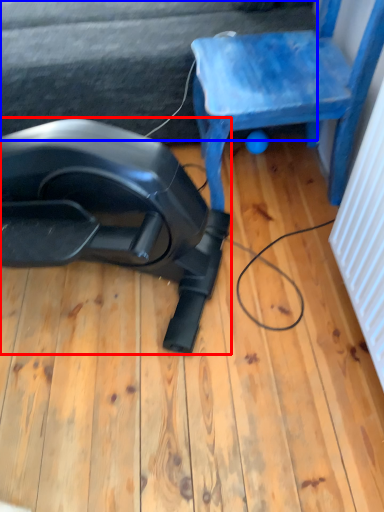
Question: Which object is further to the camera taking this photo, equipment (highlighted by a red box) or surface (highlighted by a blue box)?

Choices:
 (A) equipment
 (B) surface

Answer: (B)